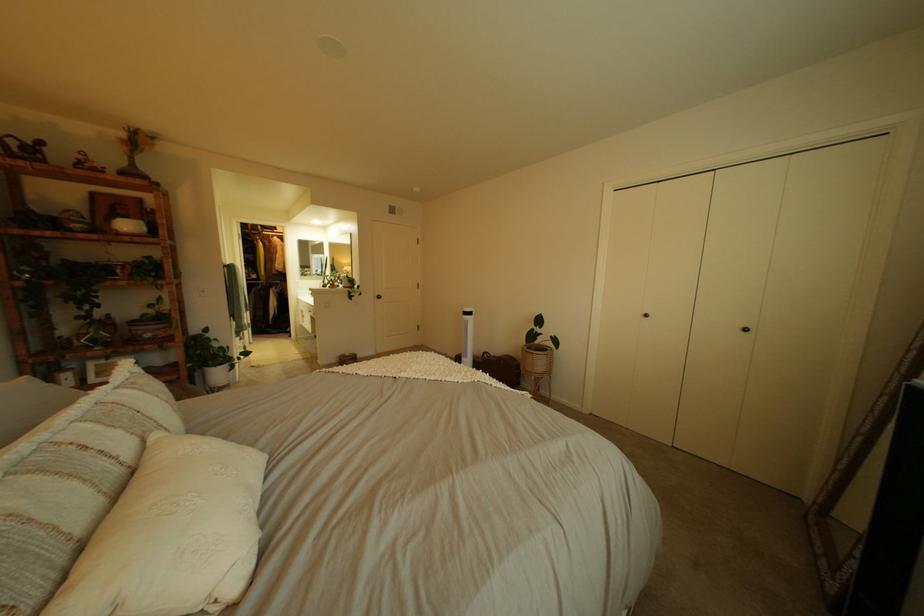
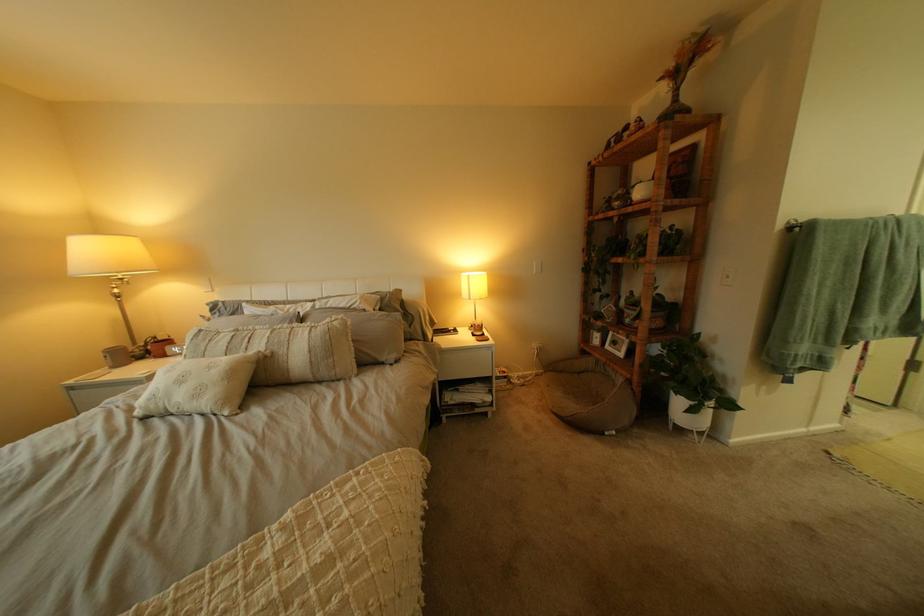
In the second image, find the point that corresponds to (134,434) in the first image.

(281, 342)